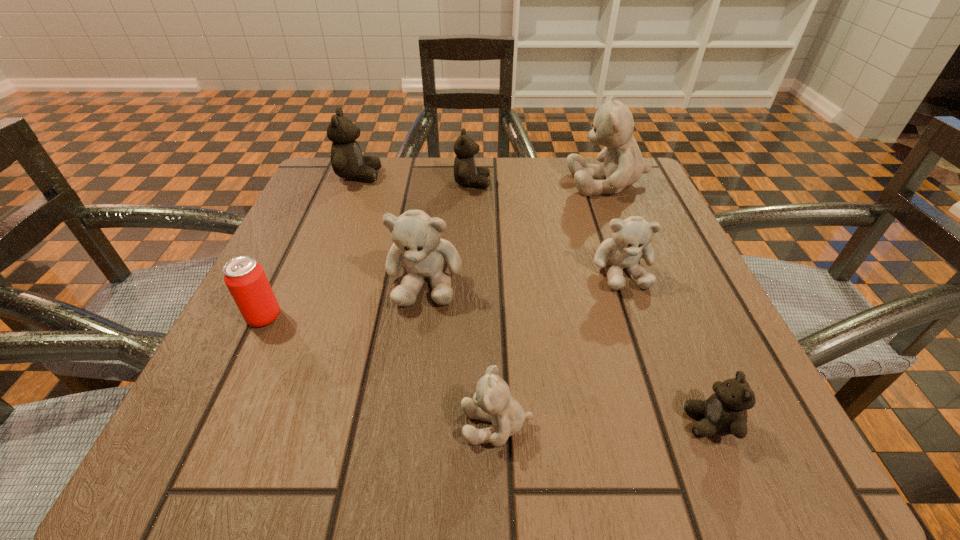
The height and width of the screenshot is (540, 960). What are the coordinates of `unoccupied position between the biggest brown teddy bear and the smallest brown teddy bear` in the screenshot? It's located at (535, 299).

At what (x,y) coordinates should I click in order to perform the action: click on empty location between the leftmost gray teddy bear and the smallest gray teddy bear. Please return your answer as a coordinate pair (x, y). This screenshot has width=960, height=540. Looking at the image, I should click on (461, 353).

Identify the location of empty space between the leftmost gray teddy bear and the red beer can. The height and width of the screenshot is (540, 960). (345, 299).

Locate an element on the screen. The image size is (960, 540). empty location between the third gray teddy bear from right to left and the second smallest gray teddy bear is located at coordinates (559, 348).

You are a GUI agent. You are given a task and a screenshot of the screen. Output one action in this format:
    pyautogui.click(x=<x>, y=<y>)
    Task: Click on the vacant space that's between the leftmost gray teddy bear and the tallest teddy bear
    This screenshot has height=540, width=960.
    Given the screenshot: What is the action you would take?
    pyautogui.click(x=516, y=232)

Find the location of `free spot between the red beer can and the rightmost brown teddy bear`. free spot between the red beer can and the rightmost brown teddy bear is located at coordinates (487, 370).

In order to click on free space that is in between the third biggest gray teddy bear and the leftmost gray teddy bear in this screenshot , I will do `click(523, 276)`.

Point out which object is positioned as the fourth nearest to the smallest gray teddy bear. Please provide its 2D coordinates. Your answer should be formatted as a tuple, i.e. [(x, y)], where the tuple contains the x and y coordinates of a point satisfying the conditions above.

[(245, 279)]

Choose which object is the fifth nearest neighbor to the second brown teddy bear from right to left. Please provide its 2D coordinates. Your answer should be formatted as a tuple, i.e. [(x, y)], where the tuple contains the x and y coordinates of a point satisfying the conditions above.

[(245, 279)]

Locate an element on the screen. This screenshot has height=540, width=960. the third closest teddy bear to the smallest brown teddy bear is located at coordinates (418, 248).